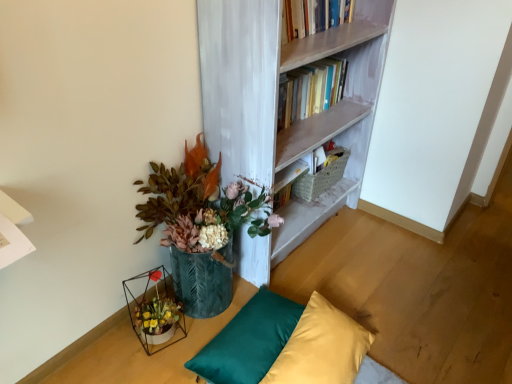
Find the location of a particular element. The height and width of the screenshot is (384, 512). empty space that is ontop of metallic wire table at lower left (from a real-world perspective) is located at coordinates (91, 331).